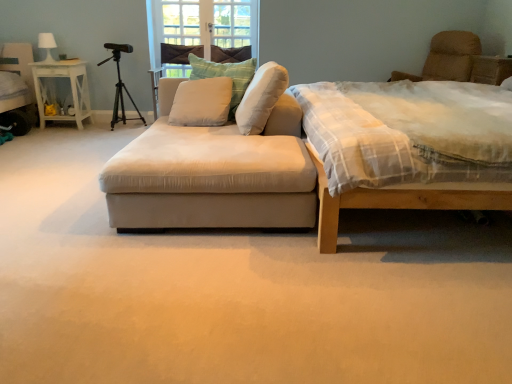
Question: Would you say light brown wooden bed at right is to the left or to the right of white painted wood nightstand at left in the picture?

Choices:
 (A) right
 (B) left

Answer: (A)

Question: From the image's perspective, is light brown wooden bed at right located above or below white painted wood nightstand at left?

Choices:
 (A) below
 (B) above

Answer: (A)

Question: Which object is positioned farthest from the black matte tripod at upper left?

Choices:
 (A) white fabric lampshade at upper left
 (B) beige fabric studio couch at center
 (C) white soft cushion at center, which is counted as the third pillow, starting from the right
 (D) white soft cushion at center, marked as the second pillow in a right-to-left arrangement
 (E) beige fabric swivel chair at upper right

Answer: (E)

Question: Estimate the real-world distances between objects in this image. Which object is closer to the beige fabric studio couch at center?

Choices:
 (A) beige fabric swivel chair at upper right
 (B) white soft cushion at center, marked as the second pillow in a right-to-left arrangement
 (C) white painted wood nightstand at left
 (D) white fabric lampshade at upper left
 (E) white soft cushion at center, which is counted as the third pillow, starting from the right

Answer: (E)